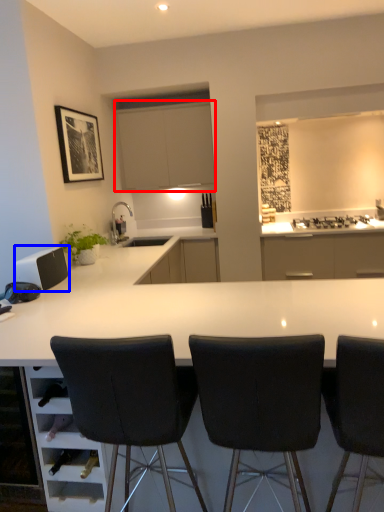
Question: Among these objects, which one is nearest to the camera, cabinetry (highlighted by a red box) or appliance (highlighted by a blue box)?

Choices:
 (A) cabinetry
 (B) appliance

Answer: (B)